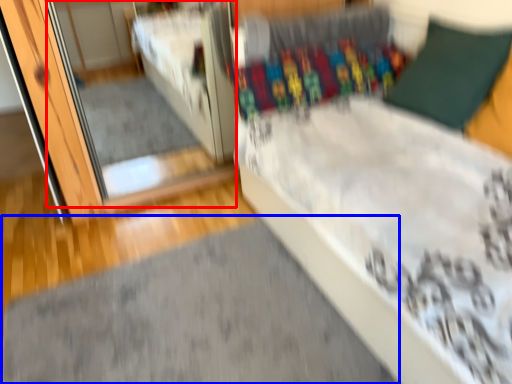
Question: Which point is further to the camera, mirror (highlighted by a red box) or doormat (highlighted by a blue box)?

Choices:
 (A) mirror
 (B) doormat

Answer: (A)